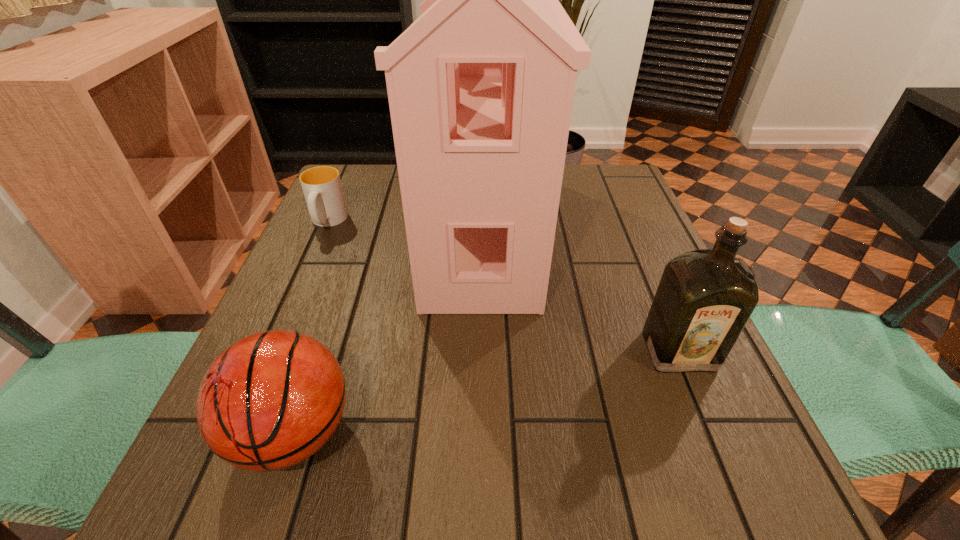
Identify the location of free space located on the label of the third shortest object. (745, 510).

You are a GUI agent. You are given a task and a screenshot of the screen. Output one action in this format:
    pyautogui.click(x=<x>, y=<y>)
    Task: Click on the vacant space located with the handle on the side of the cup
    
    Given the screenshot: What is the action you would take?
    pyautogui.click(x=289, y=309)

Find the location of `dollhouse at the far edge`. dollhouse at the far edge is located at coordinates (480, 87).

Locate an element on the screen. The image size is (960, 540). cup present at the far edge is located at coordinates (322, 188).

This screenshot has width=960, height=540. Identify the location of object that is at the near edge. (271, 400).

The height and width of the screenshot is (540, 960). What are the coordinates of `basketball that is at the left edge` in the screenshot? It's located at (271, 400).

This screenshot has width=960, height=540. What are the coordinates of `cup that is at the left edge` in the screenshot? It's located at (322, 188).

Locate an element on the screen. This screenshot has height=540, width=960. object positioned at the right edge is located at coordinates (704, 299).

Locate an element on the screen. The height and width of the screenshot is (540, 960). object located at the far left corner is located at coordinates (322, 188).

What are the coordinates of `object that is positioned at the near left corner` in the screenshot? It's located at (271, 400).